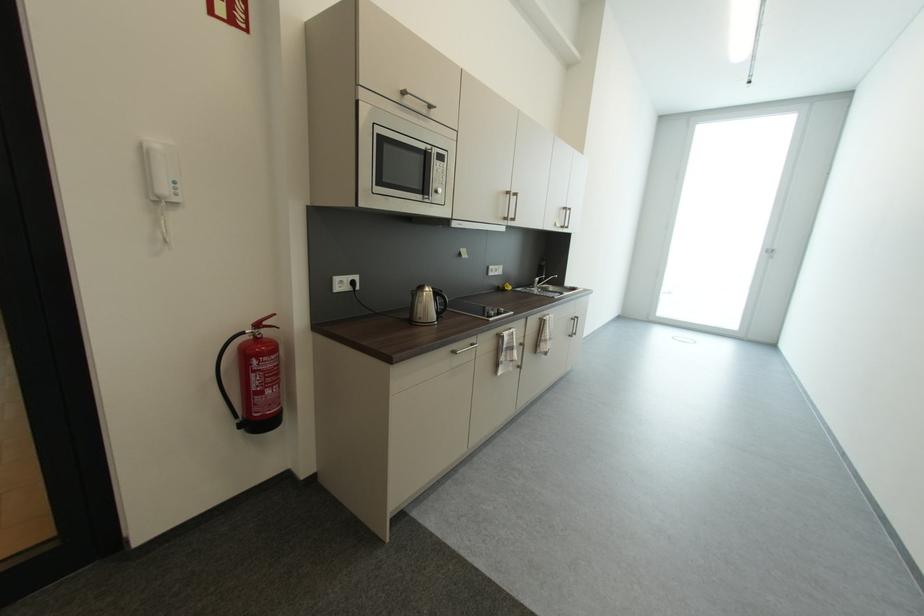
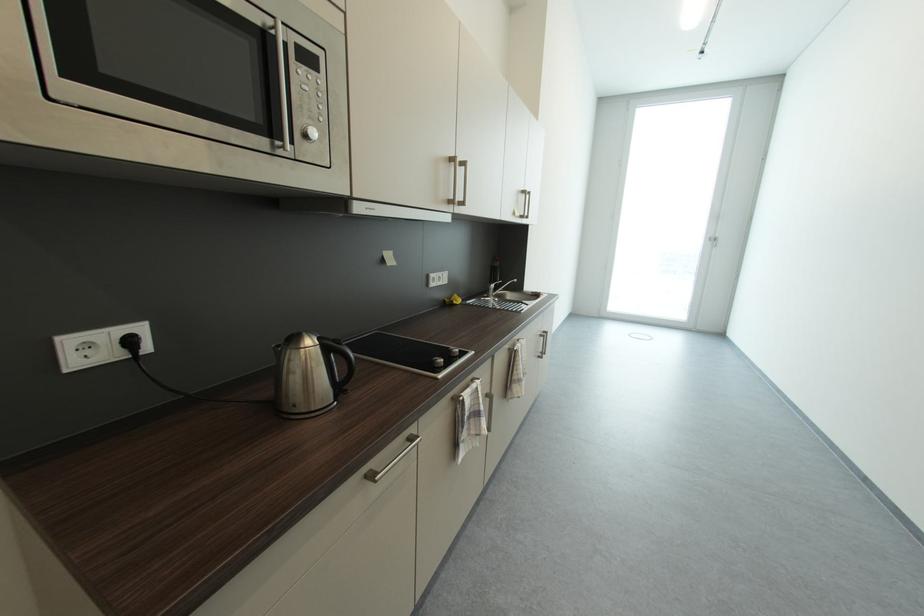
In the second image, find the point that corresponds to (359,285) in the first image.

(137, 344)